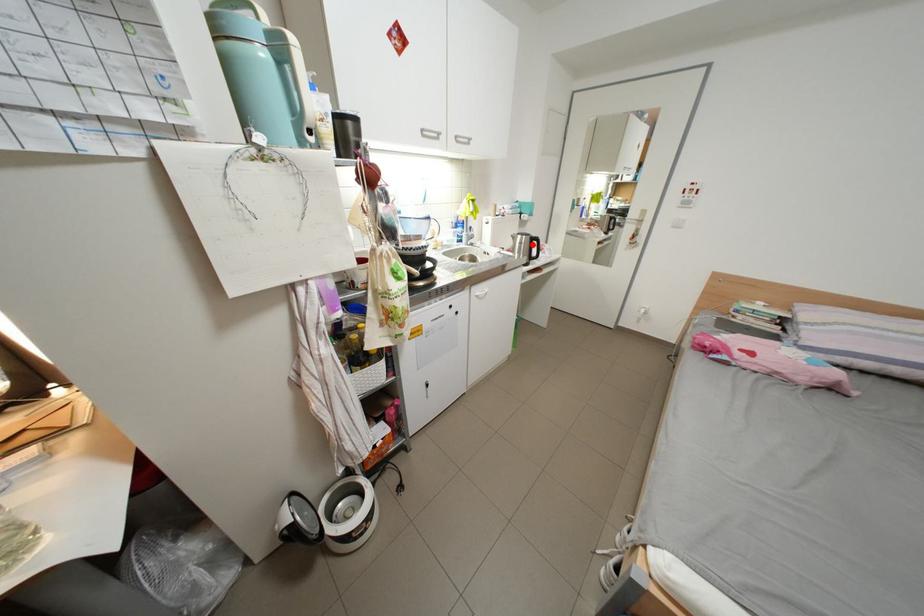
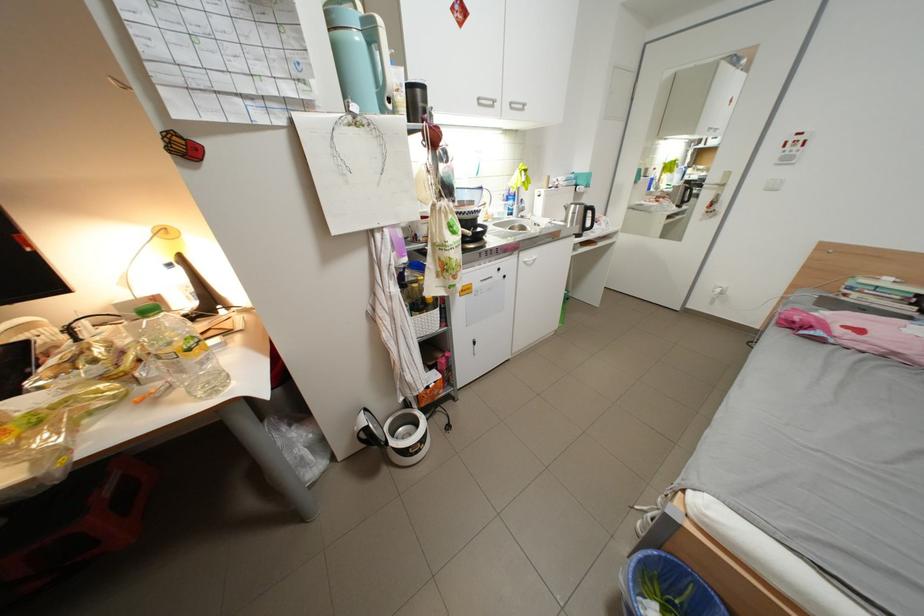
Question: I am providing you with two images of the same scene from different viewpoints. A red point is shown in image1. For the corresponding object point in image2, is it positioned nearer or farther from the camera?

Choices:
 (A) Nearer
 (B) Farther

Answer: (A)